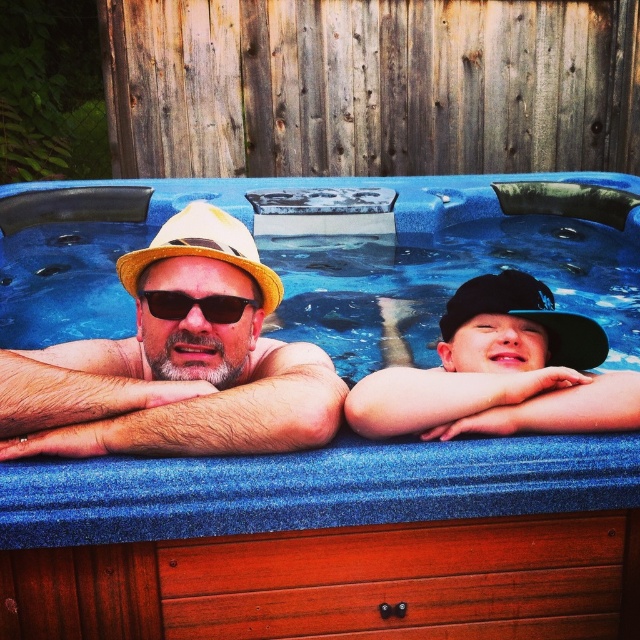
Question: Which point is farther to the camera?

Choices:
 (A) matte yellow hat at left
 (B) beige straw cowboy hat at center
 (C) wooden drawer at lower center
 (D) blue textured hot tub at center

Answer: (D)

Question: Which of the following is the closest to the observer?

Choices:
 (A) sunglasses at center
 (B) beige straw cowboy hat at center

Answer: (B)

Question: Does blue textured hot tub at center lie in front of black matte cap at upper right?

Choices:
 (A) yes
 (B) no

Answer: (B)

Question: Considering the real-world distances, which object is farthest from the black matte cap at upper right?

Choices:
 (A) matte yellow hat at left
 (B) beige straw cowboy hat at center

Answer: (B)

Question: Is matte yellow hat at left closer to the viewer compared to sunglasses at center?

Choices:
 (A) no
 (B) yes

Answer: (B)

Question: Can you confirm if blue textured hot tub at center is positioned below black matte cap at upper right?

Choices:
 (A) no
 (B) yes

Answer: (A)